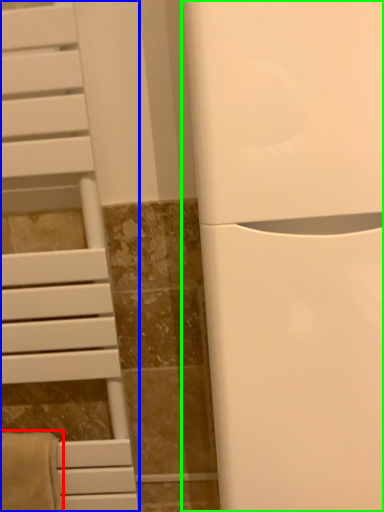
Question: Estimate the real-world distances between objects in this image. Which object is closer to bath towel (highlighted by a red box), furniture (highlighted by a blue box) or appliance (highlighted by a green box)?

Choices:
 (A) furniture
 (B) appliance

Answer: (A)